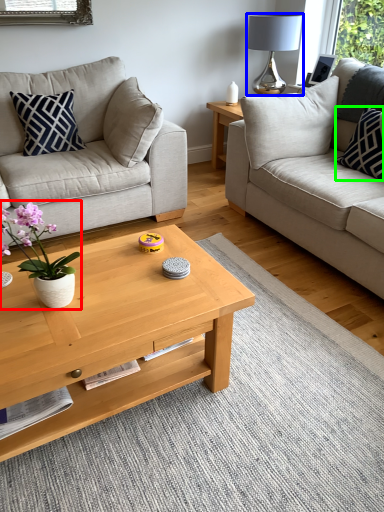
Question: Which is nearer to the houseplant (highlighted by a red box)? lamp (highlighted by a blue box) or pillow (highlighted by a green box).

Choices:
 (A) lamp
 (B) pillow

Answer: (B)